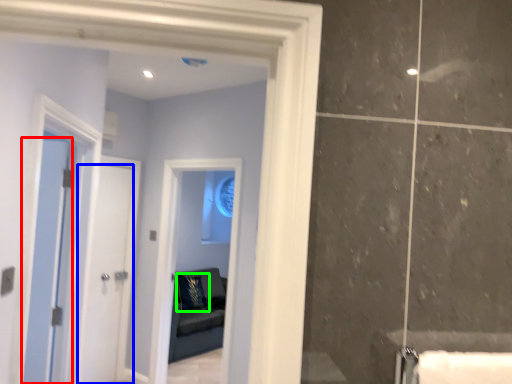
Question: Considering the real-world distances, which object is farthest from door (highlighted by a red box)? door (highlighted by a blue box) or pillow (highlighted by a green box)?

Choices:
 (A) door
 (B) pillow

Answer: (B)